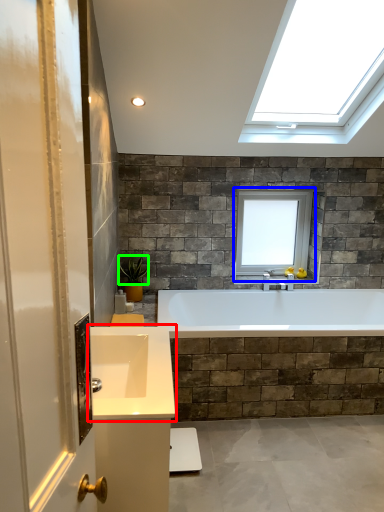
Question: Which object is the farthest from sink (highlighted by a red box)? Choose among these: window (highlighted by a blue box) or plant (highlighted by a green box).

Choices:
 (A) window
 (B) plant

Answer: (A)